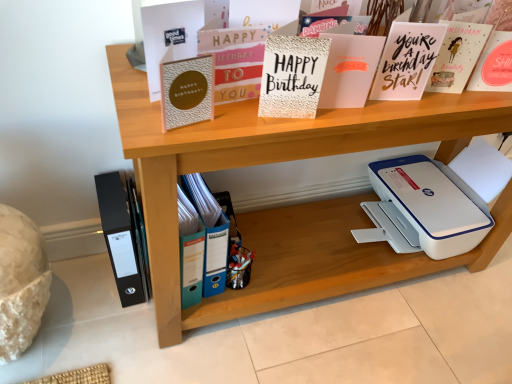
Find the location of a particular element. The image size is (512, 384). unoccupied region to the right of matte gold card at upper center, which is counted as the third paperback book, starting from the left is located at coordinates (305, 120).